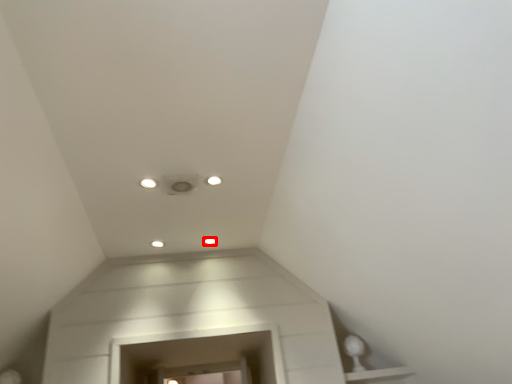
Question: From the image's perspective, where is dot (annotated by the red box) located in relation to dot in the image?

Choices:
 (A) above
 (B) below

Answer: (B)